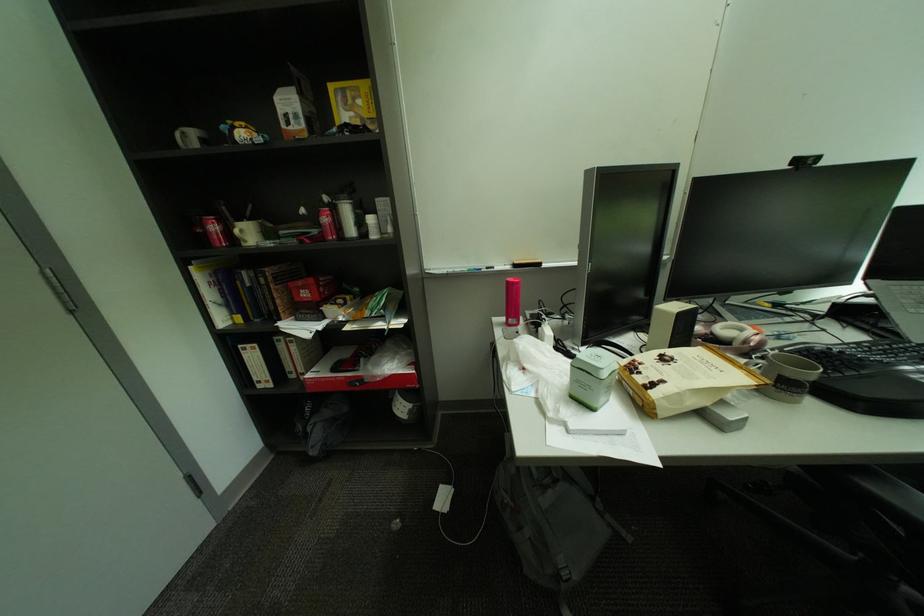
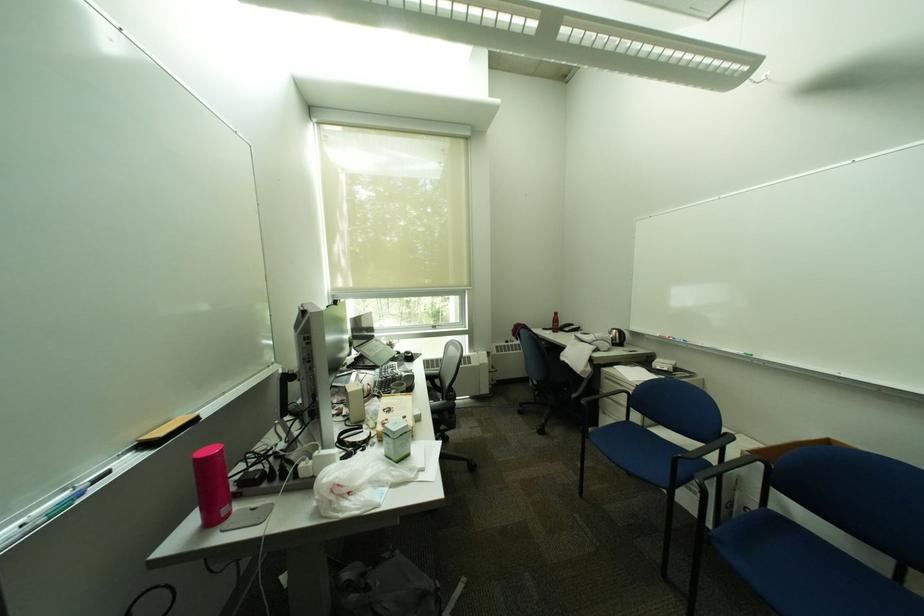
Find the pixel in the second image that matches point 650,365 in the first image.

(397, 421)